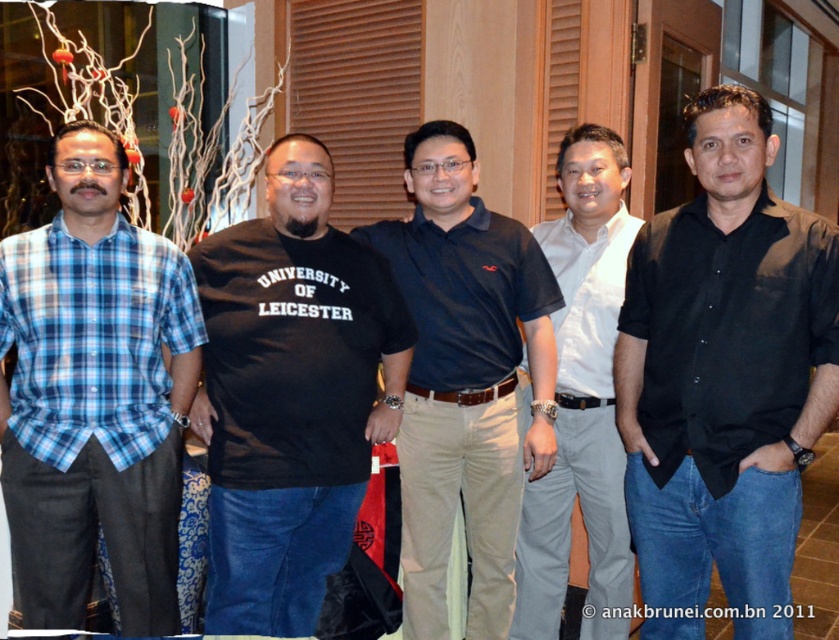
In the scene, there are two men wearing a black smooth shirt at right and a dark blue cotton polo shirt at center. Which man is standing closer to the top of the image?

The black smooth shirt at right is located above the dark blue cotton polo shirt at center, so the man wearing the black smooth shirt at right is closer to the top of the image.

Consider the image. Please describe the position of the dark blue cotton polo shirt at center in the image using the coordinate system where the bottom left corner is the origin point. The coordinate system has a width of 1 and a height of 1. The answer should be in the format of a point with two decimal places, such as point (x=465, y=380).

The dark blue cotton polo shirt at center is represented by point (x=465, y=380).